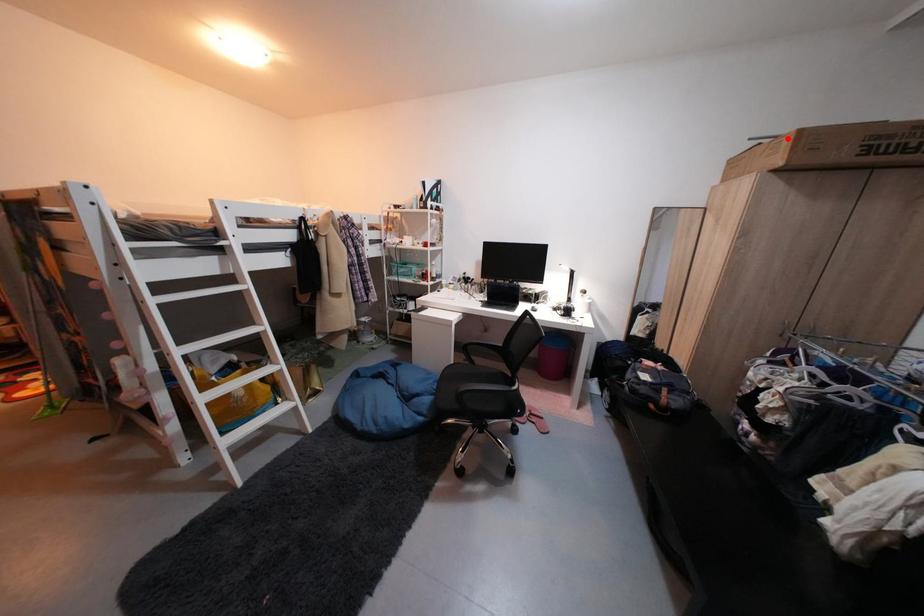
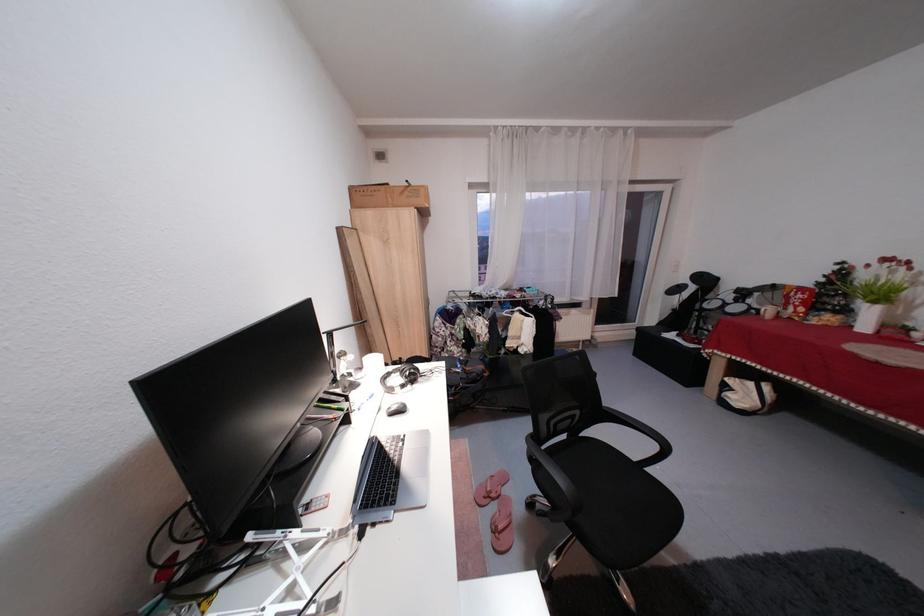
Find the pixel in the second image that matches the highlighted location in the first image.

(420, 185)